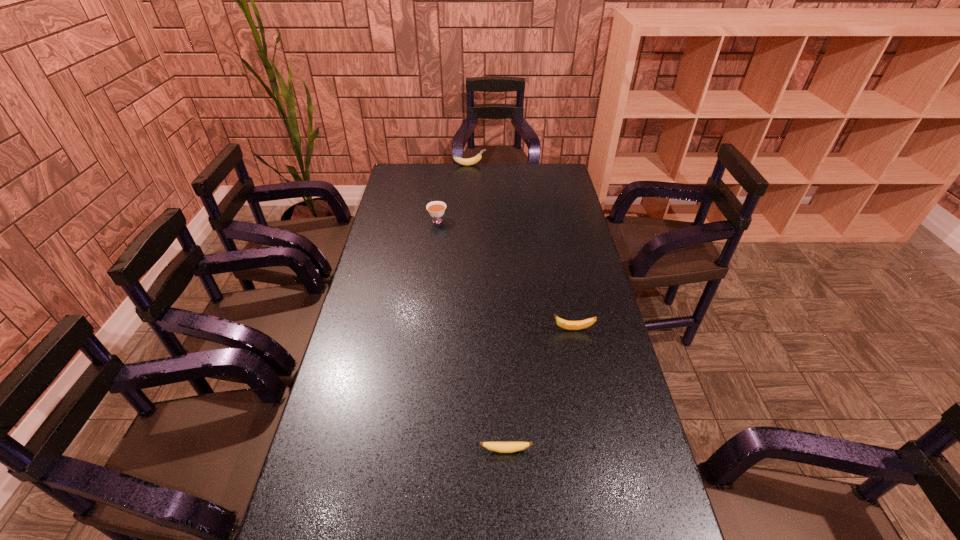
At what (x,y) coordinates should I click in order to perform the action: click on empty space between the shortest object and the farthest object. Please return your answer as a coordinate pair (x, y). This screenshot has width=960, height=540. Looking at the image, I should click on (488, 307).

Identify the location of free space between the nearest object and the leftmost object. The height and width of the screenshot is (540, 960). (471, 336).

The height and width of the screenshot is (540, 960). What are the coordinates of `free space that is in between the shortest banana and the rightmost banana` in the screenshot? It's located at (540, 390).

Where is `empty space that is in between the farthest object and the teacup`? Image resolution: width=960 pixels, height=540 pixels. empty space that is in between the farthest object and the teacup is located at coordinates (453, 193).

I want to click on free spot between the farthest object and the second farthest object, so click(x=453, y=193).

Locate an element on the screen. The image size is (960, 540). free point between the rightmost banana and the nearest object is located at coordinates (540, 390).

Locate an element on the screen. The height and width of the screenshot is (540, 960). vacant space in between the rightmost banana and the nearest banana is located at coordinates (540, 390).

At what (x,y) coordinates should I click in order to perform the action: click on empty space that is in between the second tallest banana and the third nearest object. Please return your answer as a coordinate pair (x, y). Looking at the image, I should click on (505, 275).

At what (x,y) coordinates should I click in order to perform the action: click on free space between the leftmost object and the second shortest banana. Please return your answer as a coordinate pair (x, y). Looking at the image, I should click on (505, 275).

The image size is (960, 540). What are the coordinates of `unoccupied position between the third farthest object and the teacup` in the screenshot? It's located at [505, 275].